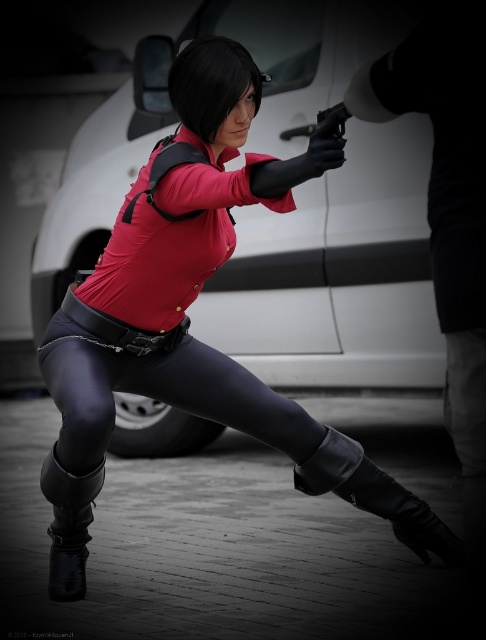
You are a photographer aiming to capture a closeup shot of the person in the scene. The camera you are using has a focal length of 50mm. Given that the point at coordinates point (77, 573) is 13.23 feet away from the camera, can you determine if this point is within the camera frame?

The point at coordinates point (77, 573) is 13.23 feet away from the camera. Since the camera is focused on the person, and the distance is within a typical framing range for a closeup, this point is likely within the camera frame.

You are a costume designer preparing for a stage play. You have to decide whether the black rubber gun at center can be holstered on the black leather leggings at center. Based on their sizes, will it fit?

The black leather leggings at center are wider than the black rubber gun at center, so the gun should fit comfortably in the holster attached to the leggings.

From the picture: You are a photographer trying to capture the black leather boot at lower left and the black rubber gun at center. Which object is closer to your camera lens?

The black leather boot at lower left is closer to the camera lens than the black rubber gun at center.